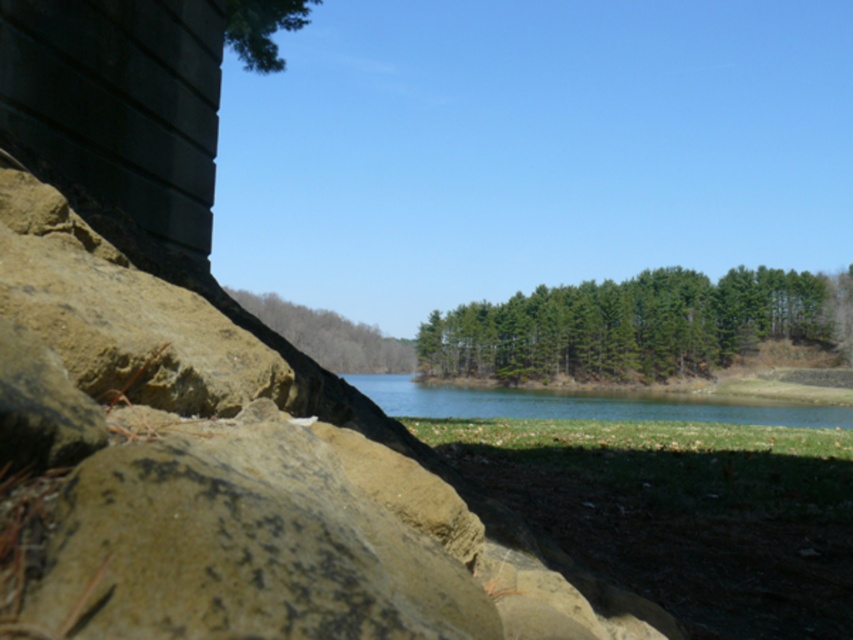
Where is `green water at center`? The height and width of the screenshot is (640, 853). green water at center is located at coordinates (585, 404).

Is point (843, 419) behind point (306, 353)?

That is False.

Is point (767, 410) farther from camera compared to point (306, 340)?

No, (767, 410) is in front of (306, 340).

Identify the location of green water at center. The width and height of the screenshot is (853, 640). (585, 404).

Can you confirm if green water at center is taller than green textured tree at upper left?

In fact, green water at center may be shorter than green textured tree at upper left.

Is point (373, 401) more distant than point (296, 20)?

That is True.

Where is `green water at center`? This screenshot has width=853, height=640. green water at center is located at coordinates (585, 404).

Is the position of green leafy trees at center less distant than that of green textured tree at upper left?

No.

Can you confirm if green leafy trees at center is positioned to the left of green textured tree at upper left?

Incorrect, green leafy trees at center is not on the left side of green textured tree at upper left.

Is point (641, 352) more distant than point (242, 4)?

Yes, it is behind point (242, 4).

Where is `green leafy trees at center`? green leafy trees at center is located at coordinates (634, 324).